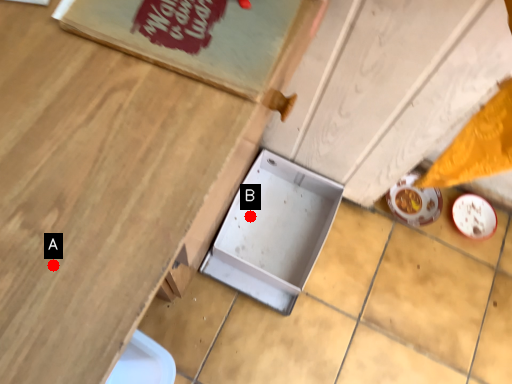
Question: Two points are circled on the image, labeled by A and B beside each circle. Which point is closer to the camera?

Choices:
 (A) A is closer
 (B) B is closer

Answer: (A)